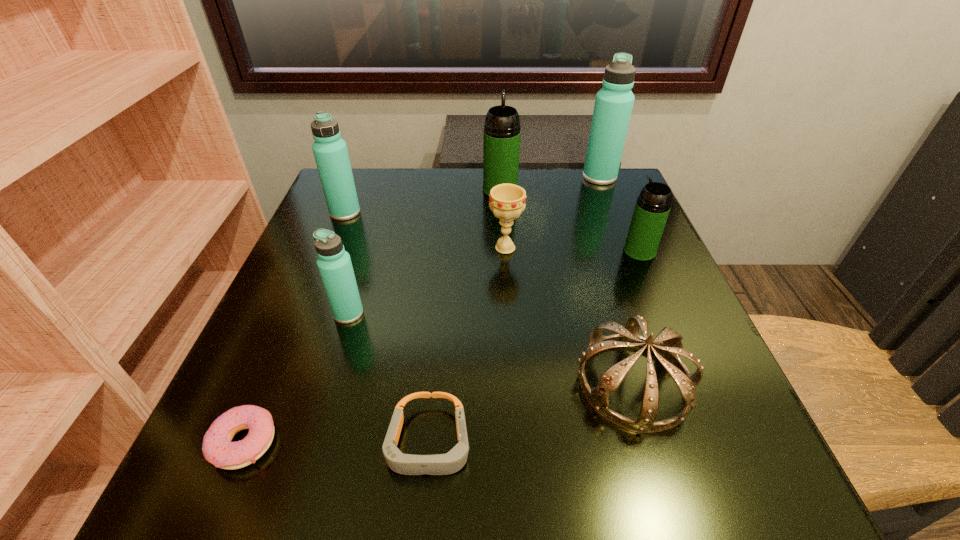
Find the location of a particular element. This screenshot has width=960, height=540. free space located 0.160m from the spout of the smaller green thermos bottle is located at coordinates (549, 251).

The width and height of the screenshot is (960, 540). Identify the location of vacant area situated 0.230m on the back of the chalice. (501, 185).

You are a GUI agent. You are given a task and a screenshot of the screen. Output one action in this format:
    pyautogui.click(x=<x>, y=<y>)
    Task: Click on the blank space located 0.160m on the back of the third shortest object
    This screenshot has height=540, width=960.
    Given the screenshot: What is the action you would take?
    pyautogui.click(x=601, y=276)

Locate an element on the screen. The width and height of the screenshot is (960, 540). vacant space located 0.300m on the right of the doughnut is located at coordinates (492, 442).

The height and width of the screenshot is (540, 960). What are the coordinates of `goggles at the near edge` in the screenshot? It's located at (440, 464).

Identify the location of doughnut located at the near edge. (217, 448).

What are the coordinates of `doughnut that is at the left edge` in the screenshot? It's located at (217, 448).

I want to click on tiara that is at the right edge, so click(x=667, y=346).

The width and height of the screenshot is (960, 540). In order to click on object that is positioned at the far left corner in this screenshot , I will do `click(330, 151)`.

I want to click on object that is at the near left corner, so click(x=217, y=448).